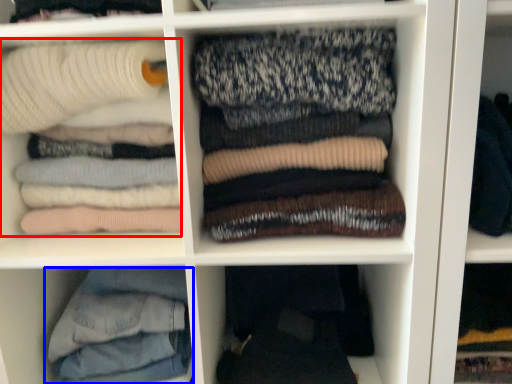
Question: Which point is further to the camera, laundry (highlighted by a red box) or trousers (highlighted by a blue box)?

Choices:
 (A) laundry
 (B) trousers

Answer: (B)